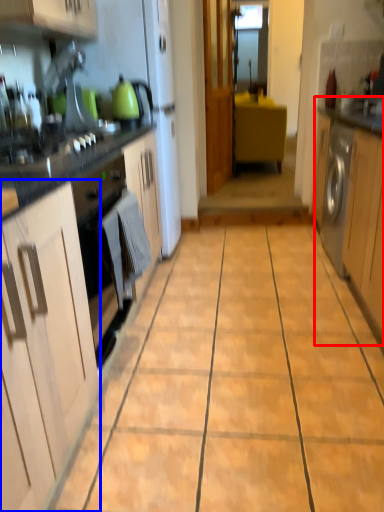
Question: Among these objects, which one is farthest to the camera, cabinetry (highlighted by a red box) or cabinetry (highlighted by a blue box)?

Choices:
 (A) cabinetry
 (B) cabinetry

Answer: (A)